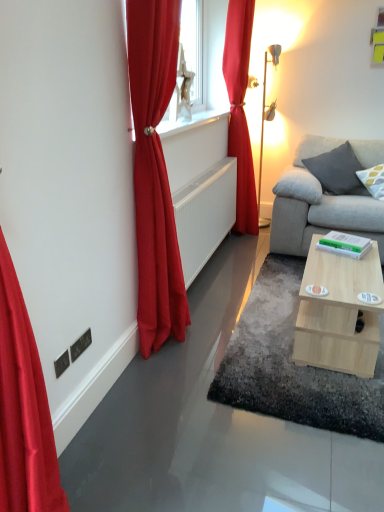
Question: Considering the relative positions of gray fabric pillow at right, the 2th pillow from the left, and satin red curtain at left, positioned as the 1th curtain in front-to-back order, in the image provided, is gray fabric pillow at right, the 2th pillow from the left, to the right of satin red curtain at left, positioned as the 1th curtain in front-to-back order, from the viewer's perspective?

Choices:
 (A) yes
 (B) no

Answer: (A)

Question: Is gray fabric pillow at right, the 2th pillow from the left, not within satin red curtain at left, positioned as the 1th curtain in front-to-back order?

Choices:
 (A) no
 (B) yes

Answer: (B)

Question: Considering the relative sizes of gray fabric pillow at right, positioned as the first pillow in right-to-left order, and satin red curtain at left, which appears as the first curtain when viewed from the left, in the image provided, is gray fabric pillow at right, positioned as the first pillow in right-to-left order, wider than satin red curtain at left, which appears as the first curtain when viewed from the left,?

Choices:
 (A) no
 (B) yes

Answer: (B)

Question: Is gray fabric pillow at right, the 2th pillow from the left, thinner than satin red curtain at left, which ranks as the second curtain in back-to-front order?

Choices:
 (A) no
 (B) yes

Answer: (A)

Question: From a real-world perspective, is gray fabric pillow at right, the 2th pillow from the left, below satin red curtain at left, which appears as the first curtain when viewed from the left?

Choices:
 (A) yes
 (B) no

Answer: (A)

Question: From their relative heights in the image, would you say metallic gold table lamp at right is taller or shorter than light wood/texture coffee table at lower right?

Choices:
 (A) short
 (B) tall

Answer: (B)

Question: In the image, is metallic gold table lamp at right positioned in front of or behind light wood/texture coffee table at lower right?

Choices:
 (A) behind
 (B) front

Answer: (A)

Question: From the image's perspective, is metallic gold table lamp at right located above or below light wood/texture coffee table at lower right?

Choices:
 (A) below
 (B) above

Answer: (B)

Question: From a real-world perspective, is metallic gold table lamp at right above or below light wood/texture coffee table at lower right?

Choices:
 (A) above
 (B) below

Answer: (A)

Question: Is satin red curtain at left, which appears as the first curtain when viewed from the left, taller or shorter than metallic gold table lamp at right?

Choices:
 (A) tall
 (B) short

Answer: (A)

Question: Looking at the image, does satin red curtain at left, which ranks as the second curtain in back-to-front order, seem bigger or smaller compared to metallic gold table lamp at right?

Choices:
 (A) small
 (B) big

Answer: (B)

Question: From a real-world perspective, is satin red curtain at left, positioned as the second curtain in right-to-left order, above or below metallic gold table lamp at right?

Choices:
 (A) above
 (B) below

Answer: (A)

Question: Considering the positions of satin red curtain at left, positioned as the second curtain in right-to-left order, and metallic gold table lamp at right in the image, is satin red curtain at left, positioned as the second curtain in right-to-left order, wider or thinner than metallic gold table lamp at right?

Choices:
 (A) wide
 (B) thin

Answer: (B)

Question: Do you think satin red curtain at left, which ranks as the second curtain in back-to-front order, is within gray fabric pillow at right, placed as the second pillow when sorted from right to left, or outside of it?

Choices:
 (A) outside
 (B) inside

Answer: (A)

Question: In terms of height, does satin red curtain at left, which ranks as the second curtain in back-to-front order, look taller or shorter compared to gray fabric pillow at right, the first pillow in the left-to-right sequence?

Choices:
 (A) short
 (B) tall

Answer: (B)